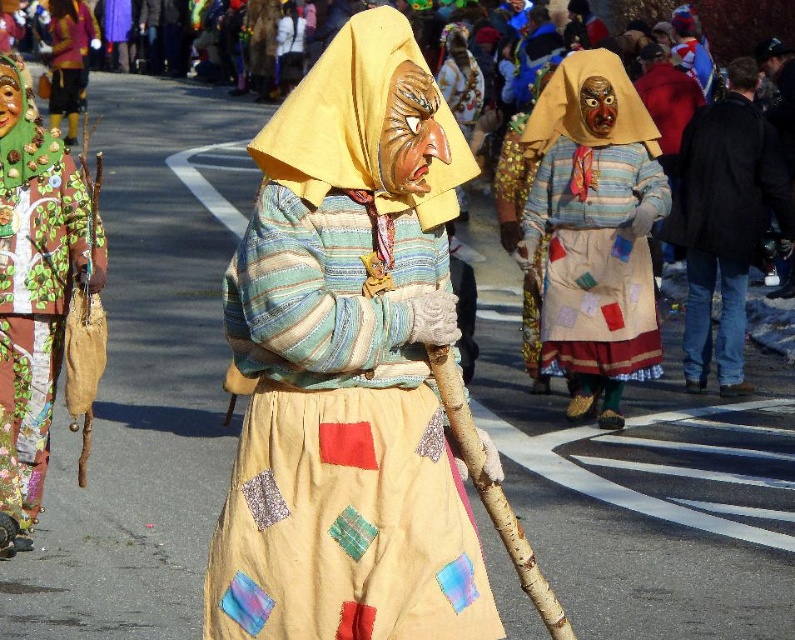
How much distance is there between matte yellow fabric mask at center and green leafy fabric bag at left?

matte yellow fabric mask at center is 9.36 feet from green leafy fabric bag at left.

Is point (396, 518) in front of point (22, 145)?

That is True.

Who is more forward, (x=339, y=269) or (x=87, y=234)?

Point (x=339, y=269) is in front.

The image size is (795, 640). What are the coordinates of `matte yellow fabric mask at center` in the screenshot? It's located at (348, 365).

Is green leafy fabric bag at left to the left of black wool coat at right from the viewer's perspective?

Yes, green leafy fabric bag at left is to the left of black wool coat at right.

Can you confirm if green leafy fabric bag at left is taller than black wool coat at right?

No.

Does point (41, 253) come in front of point (706, 321)?

Yes, it is in front of point (706, 321).

This screenshot has height=640, width=795. Identify the location of green leafy fabric bag at left. (33, 292).

Who is more distant from viewer, (378, 205) or (714, 189)?

The point (714, 189) is more distant.

Who is more distant from viewer, (402, 344) or (688, 179)?

The point (688, 179) is more distant.

The image size is (795, 640). Find the location of `matte yellow fabric mask at center`. matte yellow fabric mask at center is located at coordinates (348, 365).